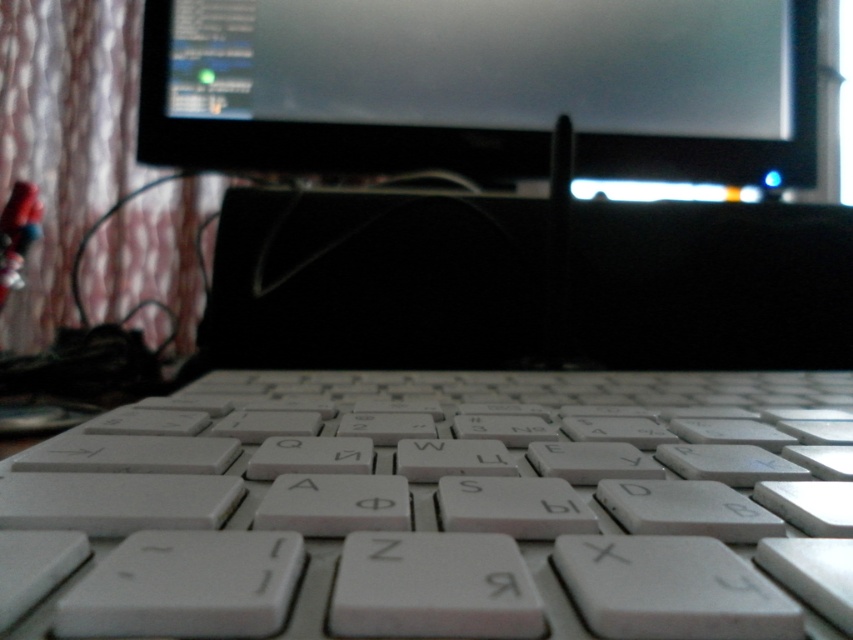
Which is behind, point (234, 513) or point (494, 97)?

Positioned behind is point (494, 97).

Does white plastic keyboard at center have a lesser width compared to black glossy monitor at upper center?

Yes, white plastic keyboard at center is thinner than black glossy monitor at upper center.

What do you see at coordinates (440, 509) in the screenshot? The image size is (853, 640). I see `white plastic keyboard at center` at bounding box center [440, 509].

This screenshot has height=640, width=853. Identify the location of white plastic keyboard at center. coord(440,509).